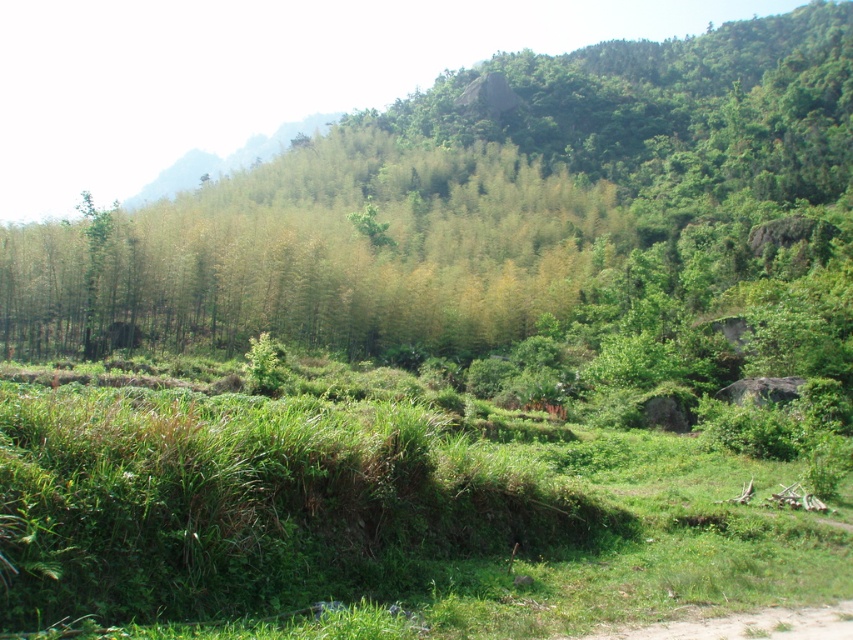
You are a hiker who wants to cross the distance between the green leafy tree at center and the green leafy grass at lower left. Can you estimate how far apart they are?

The green leafy tree at center and the green leafy grass at lower left are 134.59 meters apart from each other.